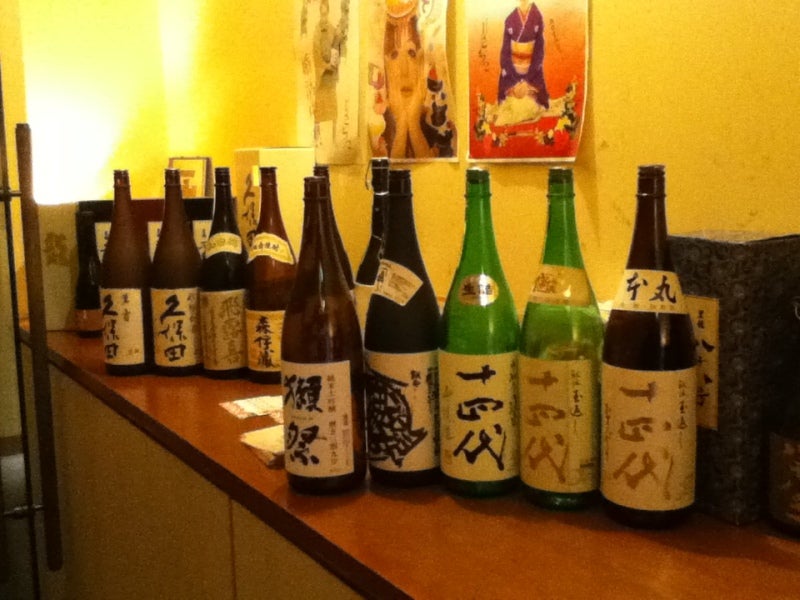
This screenshot has width=800, height=600. I want to click on japanese woman in kimono poster on the right, so click(566, 67).